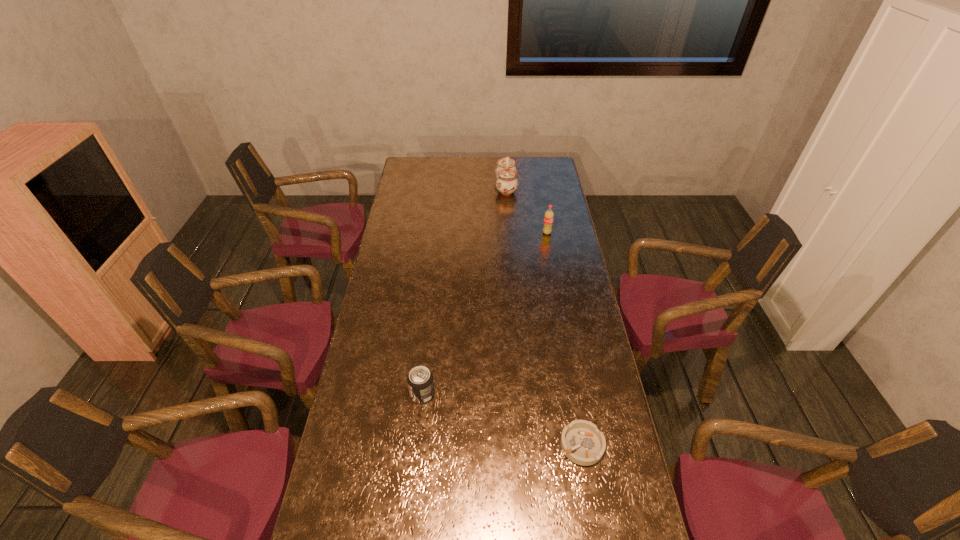
At what (x,y) coordinates should I click in order to perform the action: click on chinaware. Please return your answer as a coordinate pair (x, y). The height and width of the screenshot is (540, 960). Looking at the image, I should click on (506, 172).

Find the location of a particular element. The image size is (960, 540). the farthest object is located at coordinates (506, 172).

At what (x,y) coordinates should I click in order to perform the action: click on the taller soda can. Please return your answer as a coordinate pair (x, y). The width and height of the screenshot is (960, 540). Looking at the image, I should click on (549, 215).

Find the location of `the third nearest object`. the third nearest object is located at coordinates (549, 215).

Where is `the left soda can`? The image size is (960, 540). the left soda can is located at coordinates (420, 381).

Identify the location of the nearer soda can. The width and height of the screenshot is (960, 540). (420, 381).

The height and width of the screenshot is (540, 960). I want to click on ashtray, so click(581, 441).

You are a GUI agent. You are given a task and a screenshot of the screen. Output one action in this format:
    pyautogui.click(x=<x>, y=<y>)
    Task: Click on the shortest object
    The width and height of the screenshot is (960, 540).
    Given the screenshot: What is the action you would take?
    pyautogui.click(x=581, y=441)

Find the location of a particular element. This screenshot has height=540, width=960. vacant position located 0.050m by the handle of the chinaware is located at coordinates (486, 187).

In order to click on vacant space located 0.140m by the handle of the chinaware in this screenshot , I will do 468,187.